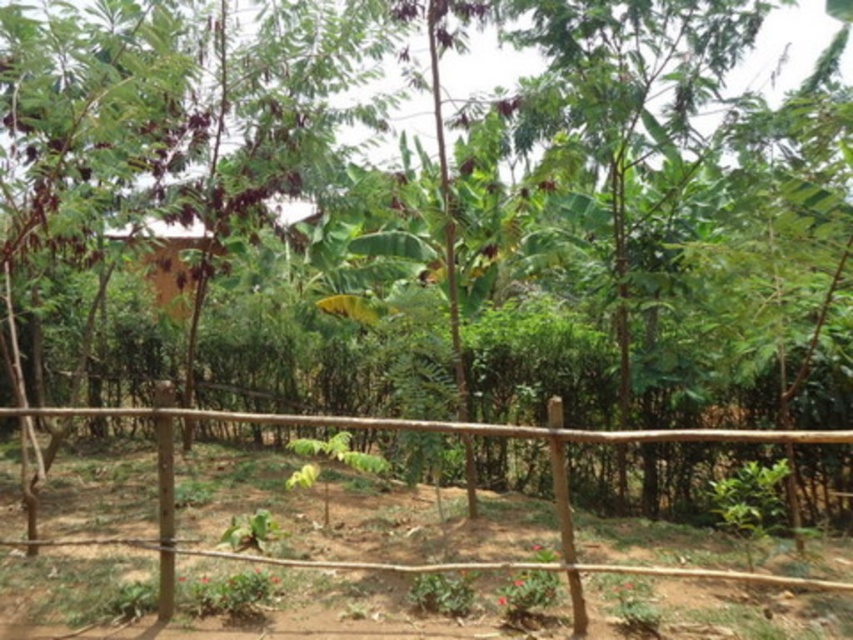
Who is more forward, [755,580] or [160,284]?

Point [755,580] is more forward.

Is brown wooden fence at center thinner than wooden hut at center?

Yes.

Locate an element on the screen. Image resolution: width=853 pixels, height=640 pixels. brown wooden fence at center is located at coordinates (463, 436).